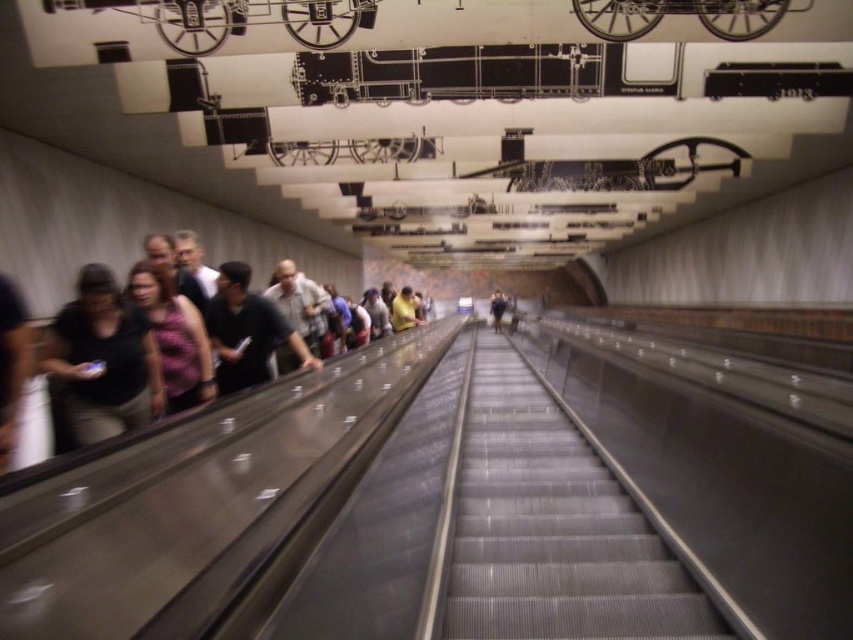
You are standing on the platform and see the metallic gray escalator at center and the purple floral dress at center. Which object is located to the right side of the other?

The metallic gray escalator at center is positioned on the right side of purple floral dress at center.

You are standing at the base of the escalator in the subway station. There are two points marked on the handrail of the moving escalator. The first point is at coordinates point (x=61, y=317) and the second point is at point (x=151, y=317). Which point is closer to you as you look at the escalator?

Point (x=61, y=317) is closer to the viewer than point (x=151, y=317).

You are standing at the bottom of the metallic gray escalator at center and see the purple floral dress at center in the distance. Which object is closer to you?

The metallic gray escalator at center is closer to you because it is in front of the purple floral dress at center.